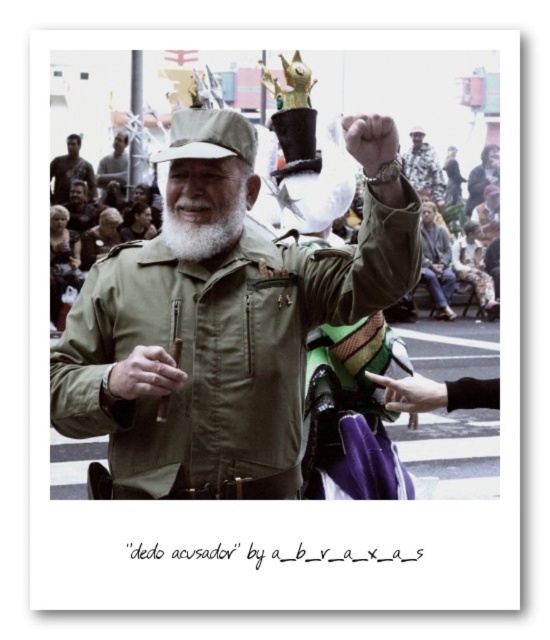
Is white matte beard at center closer to the viewer compared to matte khaki hat at center?

No.

Which is above, white matte beard at center or matte khaki hat at center?

matte khaki hat at center is above.

Which is in front, point (190, 232) or point (250, 125)?

Point (190, 232)

This screenshot has height=640, width=550. I want to click on white matte beard at center, so click(202, 225).

Does camouflage fabric watch at upper right appear under matte brown shirt at upper left?

No.

Is camouflage fabric watch at upper right further to the viewer compared to matte brown shirt at upper left?

Yes, camouflage fabric watch at upper right is behind matte brown shirt at upper left.

Is point (414, 170) behind point (64, 161)?

Yes, point (414, 170) is farther from viewer.

Find the location of a particular element. camouflage fabric watch at upper right is located at coordinates (424, 168).

Can you confirm if matte brown hand at upper center is positioned to the left of matte black cap at upper center?

In fact, matte brown hand at upper center is to the right of matte black cap at upper center.

What do you see at coordinates (371, 140) in the screenshot?
I see `matte brown hand at upper center` at bounding box center [371, 140].

You are a GUI agent. You are given a task and a screenshot of the screen. Output one action in this format:
    pyautogui.click(x=<x>, y=<y>)
    Task: Click on the matte brown hand at upper center
    This screenshot has height=640, width=550.
    Given the screenshot: What is the action you would take?
    pyautogui.click(x=371, y=140)